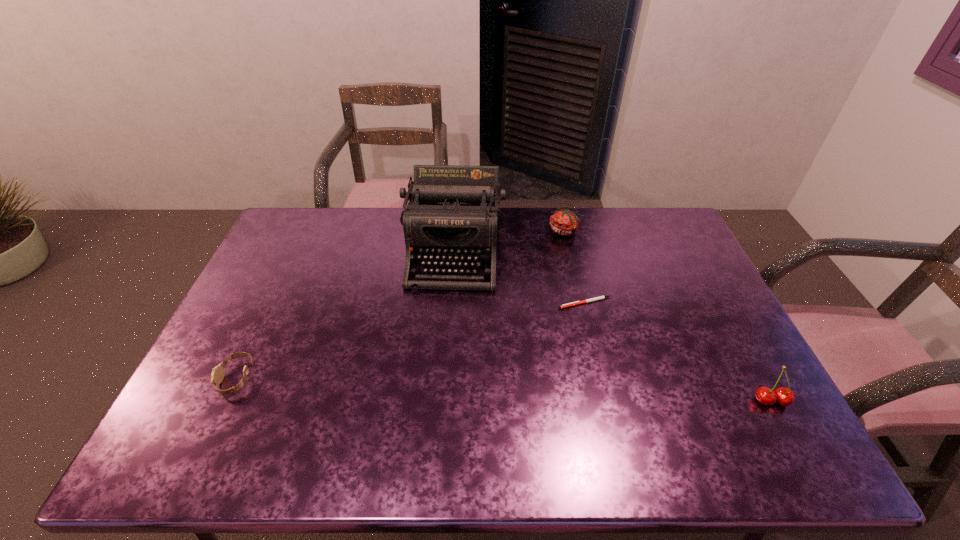
The width and height of the screenshot is (960, 540). In order to click on vacant space on the desktop that is between the leftmost object and the rightmost object and is positioned on the front-facing side of the third shortest object in this screenshot , I will do `click(542, 391)`.

Identify the location of vacant space on the desktop that is between the watch and the rightmost object and is positioned on the clicker of the third farthest object. (499, 389).

The height and width of the screenshot is (540, 960). Find the location of `vacant spot on the desktop that is between the leftmost object and the fourth shortest object and is positioned on the keyboard of the typewriter`. vacant spot on the desktop that is between the leftmost object and the fourth shortest object and is positioned on the keyboard of the typewriter is located at coordinates (438, 386).